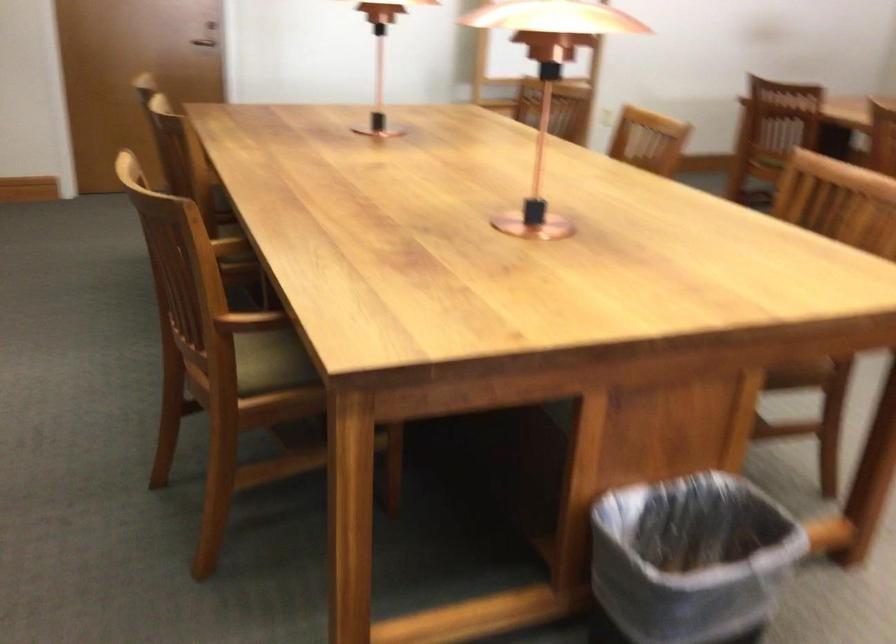
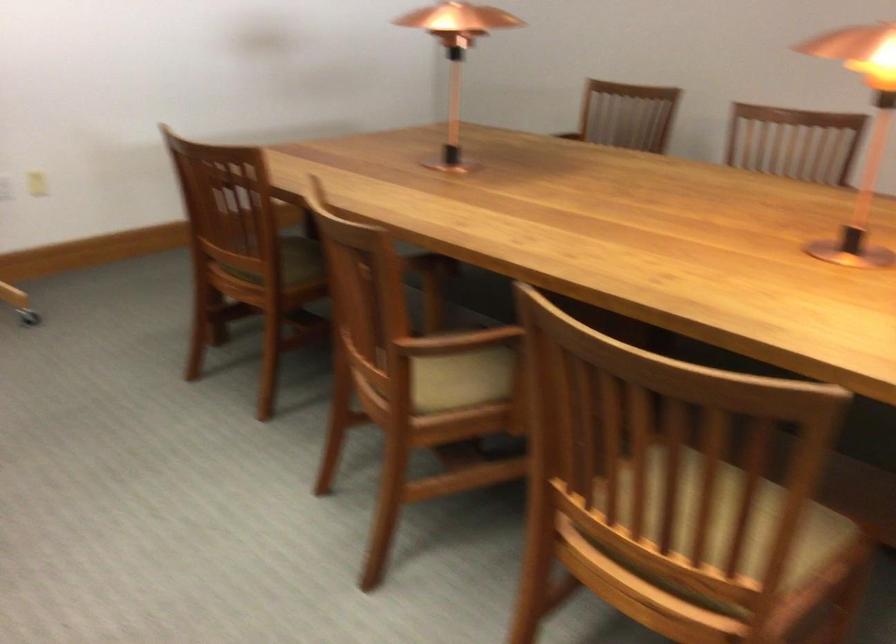
Locate, in the second image, the point that corresponds to (x=605, y=90) in the first image.

(37, 184)